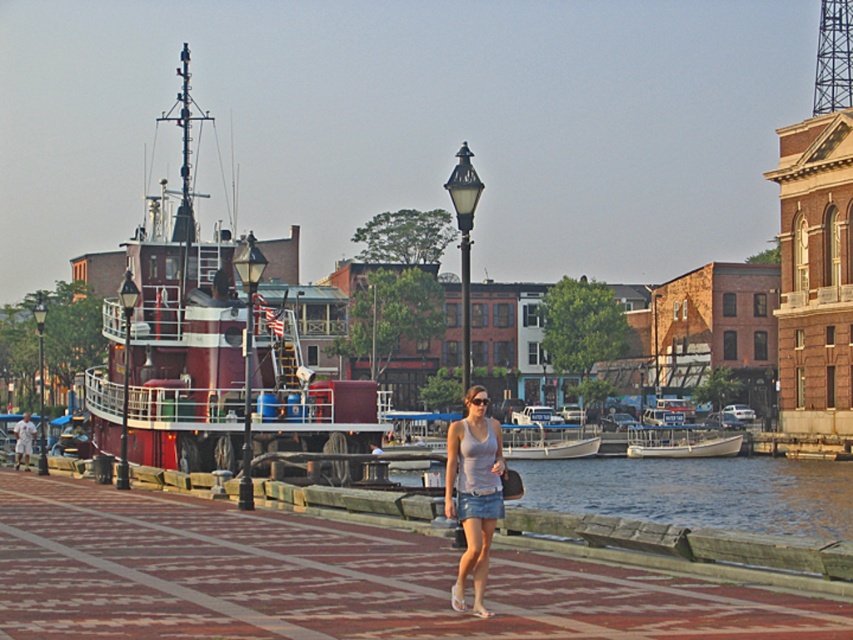
Is smooth wooden dock at center shorter than matte black lamp post at center?

Indeed, smooth wooden dock at center has a lesser height compared to matte black lamp post at center.

Is point (532, 481) farther from viewer compared to point (463, 186)?

Yes, point (532, 481) is farther from viewer.

The image size is (853, 640). What do you see at coordinates (700, 492) in the screenshot?
I see `smooth wooden dock at center` at bounding box center [700, 492].

You are a GUI agent. You are given a task and a screenshot of the screen. Output one action in this format:
    pyautogui.click(x=<x>, y=<y>)
    Task: Click on the smooth wooden dock at center
    Image resolution: width=853 pixels, height=640 pixels.
    Given the screenshot: What is the action you would take?
    pyautogui.click(x=700, y=492)

Can you confirm if denim shorts at center is positioned above white fiberglass boat at center?

Indeed, denim shorts at center is positioned over white fiberglass boat at center.

Is the position of denim shorts at center more distant than that of white fiberglass boat at center?

No.

You are a GUI agent. You are given a task and a screenshot of the screen. Output one action in this format:
    pyautogui.click(x=<x>, y=<y>)
    Task: Click on the denim shorts at center
    
    Given the screenshot: What is the action you would take?
    pyautogui.click(x=474, y=492)

At what (x,y) coordinates should I click in order to perform the action: click on denim shorts at center. Please return your answer as a coordinate pair (x, y). This screenshot has width=853, height=640. Looking at the image, I should click on (474, 492).

Is wooden at center above denim shorts at center?

No.

Is point (639, 588) positioned in front of point (485, 614)?

No, it is not.

I want to click on wooden at center, so click(x=328, y=579).